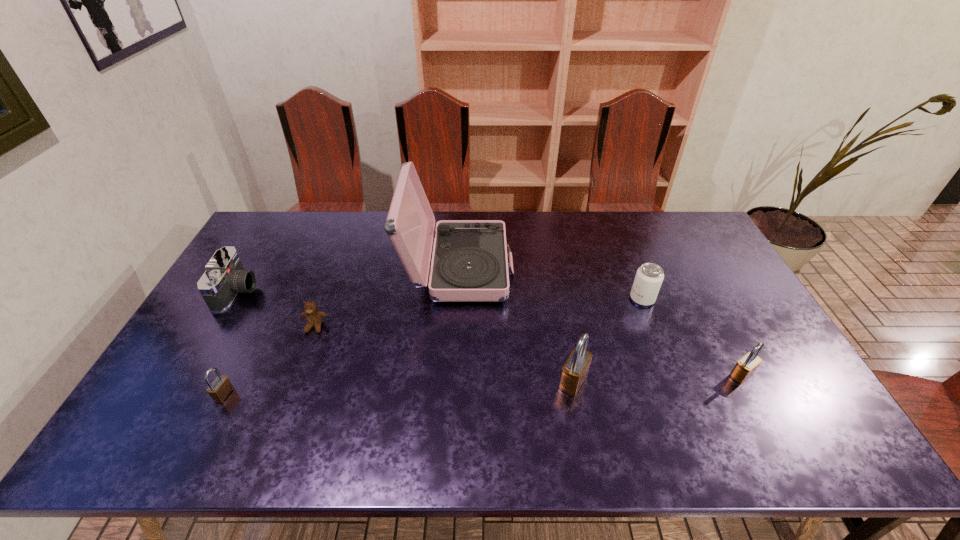
You are a GUI agent. You are given a task and a screenshot of the screen. Output one action in this format:
    pyautogui.click(x=<x>, y=<y>)
    Task: Click on the free region at the far right corner
    This screenshot has width=960, height=540.
    Given the screenshot: What is the action you would take?
    pyautogui.click(x=669, y=246)

In order to click on blank region between the rightmost padlock and the soda can in this screenshot , I will do `click(691, 337)`.

Identify the location of blank region between the second object from right to left and the rightmost padlock. (691, 337).

This screenshot has height=540, width=960. Find the location of `vacant space in between the shortest padlock and the third object from right to left`. vacant space in between the shortest padlock and the third object from right to left is located at coordinates (398, 388).

Locate an element on the screen. free space between the tallest object and the shortest padlock is located at coordinates (341, 332).

Identify the location of empty location between the leftmost padlock and the camera. (230, 343).

Locate an element on the screen. empty space between the sixth object from left to right and the third object from right to left is located at coordinates (608, 340).

You are a GUI agent. You are given a task and a screenshot of the screen. Output one action in this format:
    pyautogui.click(x=<x>, y=<y>)
    Task: Click on the vacant space in between the camera and the tallest object
    
    Given the screenshot: What is the action you would take?
    (x=348, y=280)

Image resolution: width=960 pixels, height=540 pixels. Identify the location of vacant point located between the record player and the sixth object from left to right. (550, 284).

Where is `vacant point located between the rightmost object and the camera`? This screenshot has width=960, height=540. vacant point located between the rightmost object and the camera is located at coordinates (489, 333).